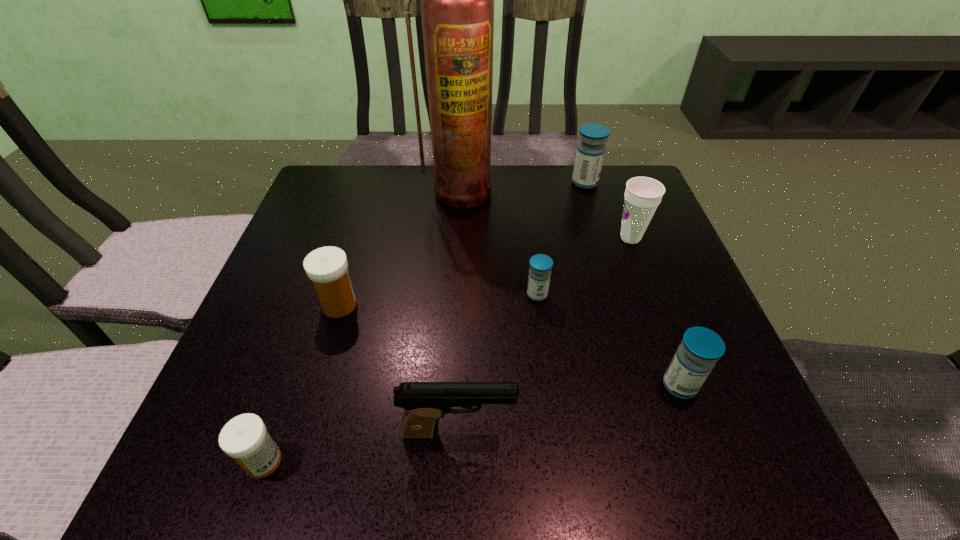
At what (x,y) coordinates should I click in order to perform the action: click on free space located on the back of the second smallest blue medicine. Please return your answer as a coordinate pair (x, y). Image resolution: width=960 pixels, height=540 pixels. Looking at the image, I should click on (665, 347).

You are a GUI agent. You are given a task and a screenshot of the screen. Output one action in this format:
    pyautogui.click(x=<x>, y=<y>)
    Task: Click on the free space located 0.080m on the right of the third medicine from left to right
    Image resolution: width=960 pixels, height=540 pixels.
    Given the screenshot: What is the action you would take?
    pos(588,295)

This screenshot has width=960, height=540. I want to click on blank space located on the back of the smaller white medicine, so click(288, 390).

You are a GUI agent. You are given a task and a screenshot of the screen. Output one action in this format:
    pyautogui.click(x=<x>, y=<y>)
    Task: Click on the fire extinguisher that is at the far edge
    
    Given the screenshot: What is the action you would take?
    pyautogui.click(x=457, y=0)

This screenshot has height=540, width=960. I want to click on medicine that is at the far edge, so click(590, 153).

At what (x,y) coordinates should I click in order to perform the action: click on pistol that is at the near edge. Please return your answer as a coordinate pair (x, y). Looking at the image, I should click on (424, 403).

At what (x,y) coordinates should I click in order to perform the action: click on medicine located in the near edge section of the desktop. Please return your answer as a coordinate pair (x, y). The height and width of the screenshot is (540, 960). Looking at the image, I should click on (245, 438).

This screenshot has width=960, height=540. Identify the location of cup present at the right edge. (642, 195).

Where is `object present at the near left corner`? This screenshot has height=540, width=960. object present at the near left corner is located at coordinates pos(245,438).

Image resolution: width=960 pixels, height=540 pixels. What are the coordinates of `object that is at the far right corner` in the screenshot? It's located at (590, 153).